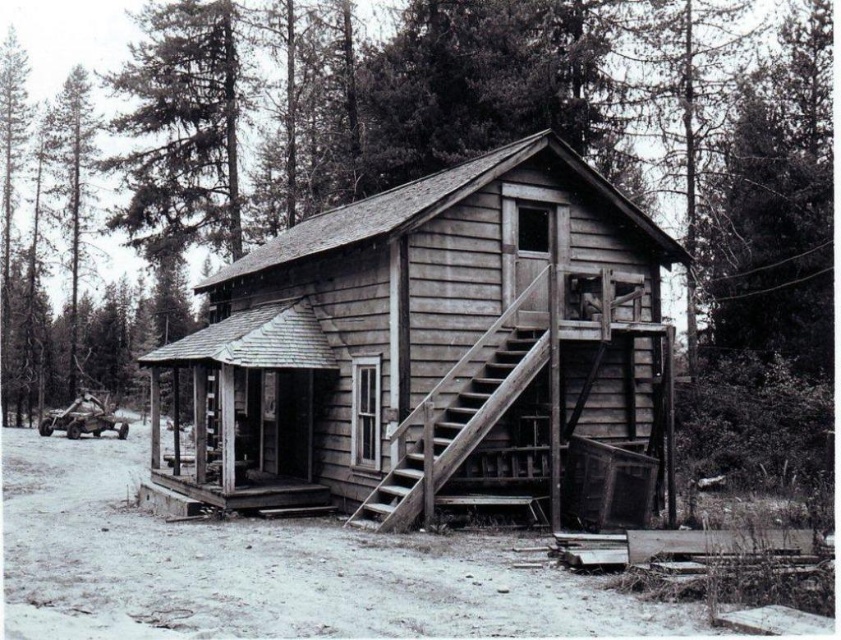
Question: Is weathered wood cabin at center in front of weathered wood stairs at center?

Choices:
 (A) yes
 (B) no

Answer: (B)

Question: Which point is farther from the camera taking this photo?

Choices:
 (A) (443, 278)
 (B) (369, 506)

Answer: (A)

Question: Can you confirm if weathered wood cabin at center is positioned to the right of weathered wood stairs at center?

Choices:
 (A) no
 (B) yes

Answer: (A)

Question: Can you confirm if weathered wood cabin at center is wider than weathered wood stairs at center?

Choices:
 (A) no
 (B) yes

Answer: (B)

Question: Which object appears farthest from the camera in this image?

Choices:
 (A) weathered wood cabin at center
 (B) weathered wood stairs at center

Answer: (A)